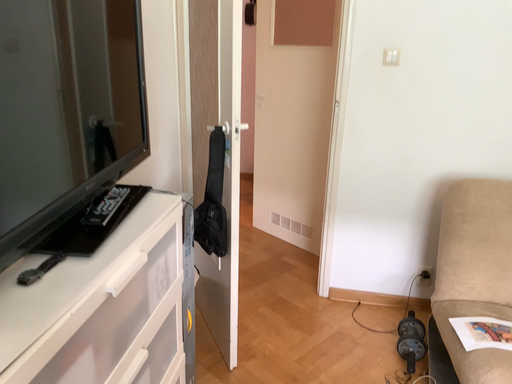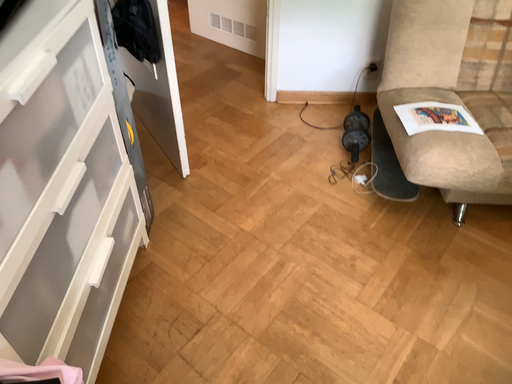
Question: How did the camera likely rotate when shooting the video?

Choices:
 (A) rotated left
 (B) rotated right

Answer: (B)